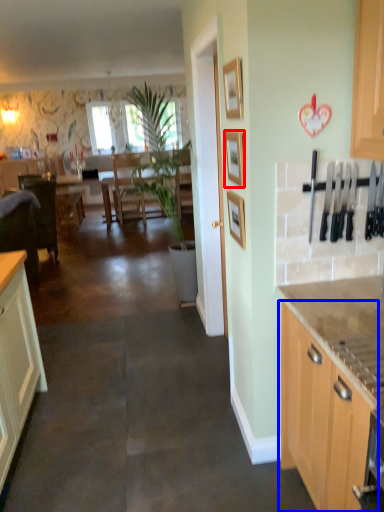
Question: Which point is closer to the camera, picture frame (highlighted by a red box) or cabinetry (highlighted by a blue box)?

Choices:
 (A) picture frame
 (B) cabinetry

Answer: (B)